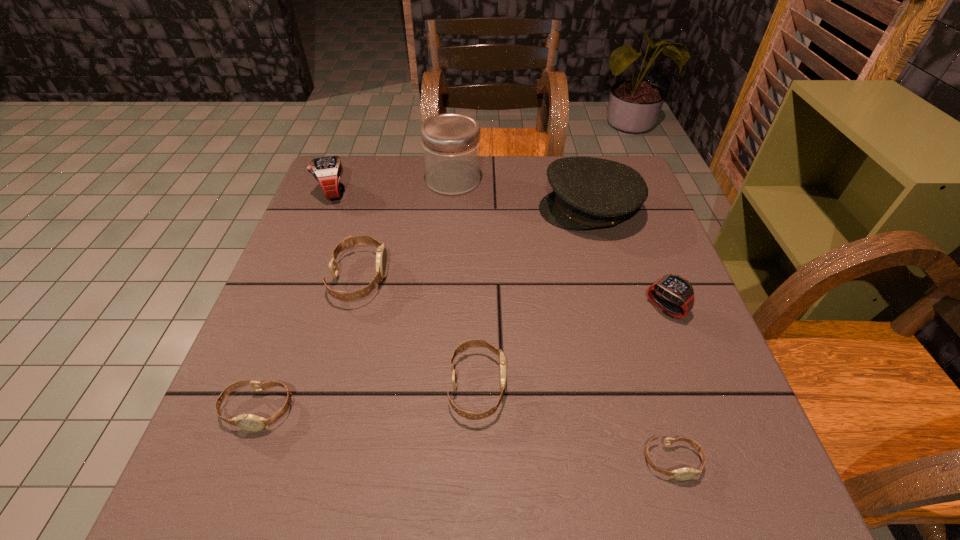
At what (x,y) coordinates should I click in order to perform the action: click on the fourth closest beige watch to the sixth shortest object. Please return your answer as a coordinate pair (x, y). This screenshot has width=960, height=540. Looking at the image, I should click on (687, 473).

I want to click on vacant position in the image that satisfies the following two spatial constraints: 1. on the front-facing side of the smaller red watch; 2. on the right side of the gray beret, so click(616, 308).

Locate an element on the screen. This screenshot has width=960, height=540. vacant point that satisfies the following two spatial constraints: 1. on the face of the biggest beige watch; 2. on the left side of the nearer red watch is located at coordinates (351, 308).

Find the location of a particular element. vacant position in the image that satisfies the following two spatial constraints: 1. on the front-facing side of the beret; 2. on the back side of the right red watch is located at coordinates (616, 308).

At what (x,y) coordinates should I click in order to perform the action: click on vacant space that satisfies the following two spatial constraints: 1. on the front-facing side of the gray beret; 2. on the back side of the nearer red watch. Please return your answer as a coordinate pair (x, y). This screenshot has width=960, height=540. Looking at the image, I should click on (616, 308).

Locate an element on the screen. vacant area that satisfies the following two spatial constraints: 1. on the front-facing side of the seventh shortest object; 2. on the face of the second shortest object is located at coordinates (645, 410).